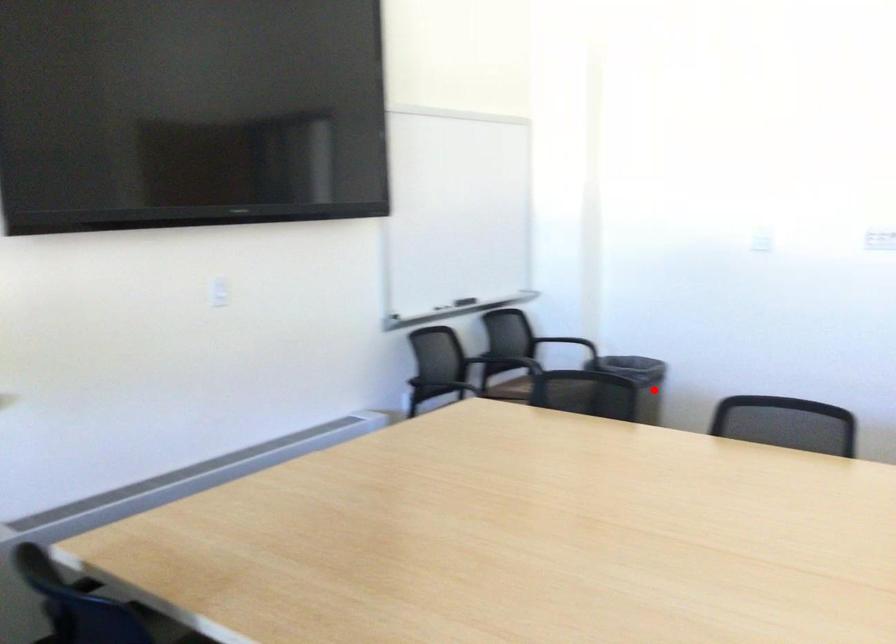
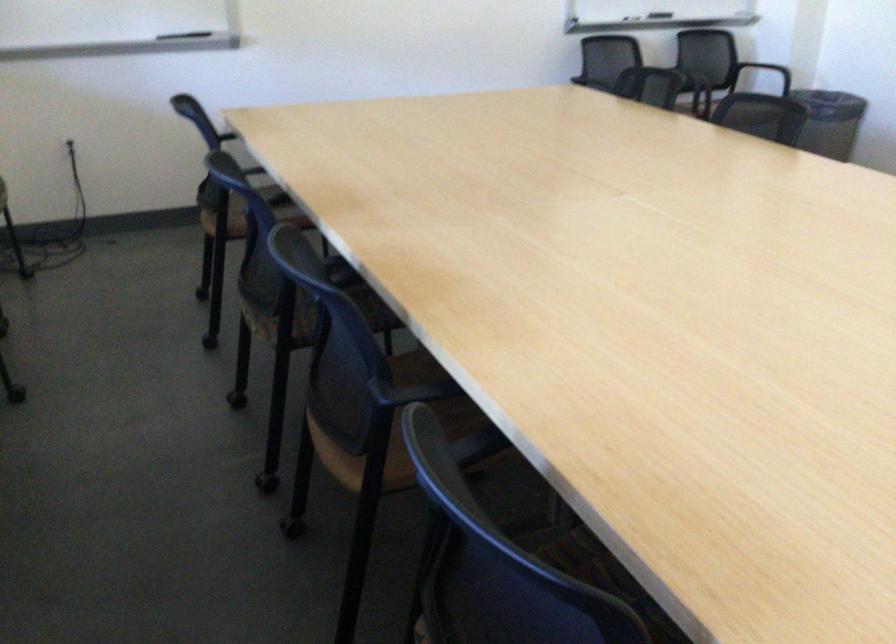
Where in the second image is the point corresponding to the highlighted location from the first image?

(830, 122)